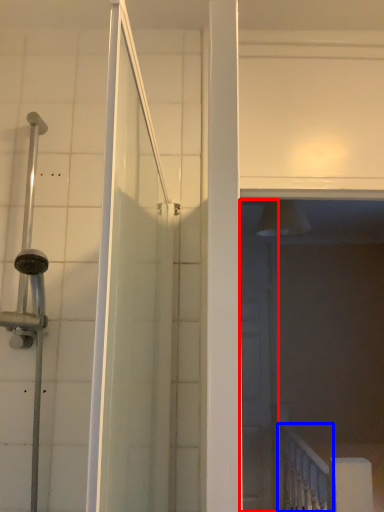
Question: Which object appears closest to the camera in this image, screen door (highlighted by a red box) or rail (highlighted by a blue box)?

Choices:
 (A) screen door
 (B) rail

Answer: (B)